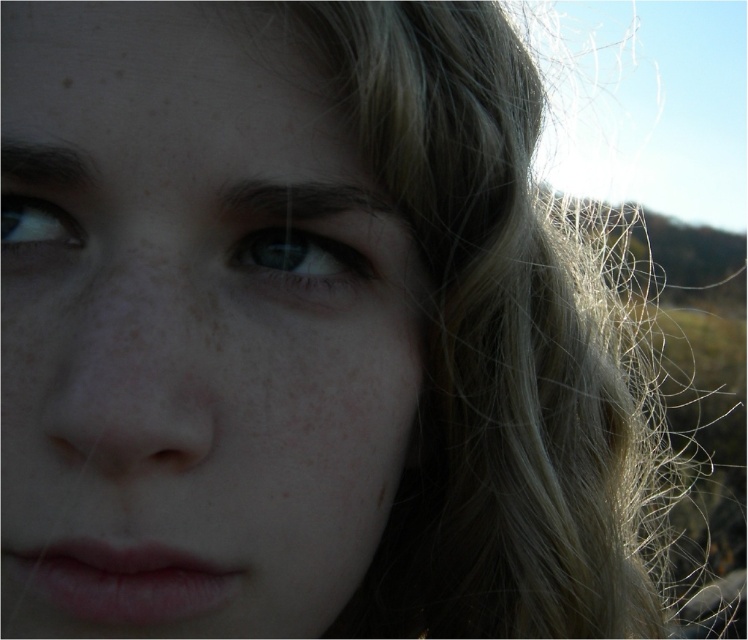
You are a photographer adjusting the focus on your camera. You want to ensure both the smooth skin face at center and the matte blue eye at upper left are in focus. Given the depth of field, what is the minimum distance you need to set between the two objects to achieve this?

The minimum distance required to keep both the smooth skin face at center and the matte blue eye at upper left in focus is 2.93 inches, as that is the exact distance between them.

You are a photographer adjusting the lighting for a portrait. You notice the blue glossy eye at center and the matte blue eye at upper left in the frame. Which eye appears larger in height in the photo?

The blue glossy eye at center is much taller than the matte blue eye at upper left, so it appears larger in height in the photo.

Based on the scene description, can you determine if the smooth skin face at center is wider than the blue glossy eye at center?

The smooth skin face at center is wider than the blue glossy eye at center according to the objects description.